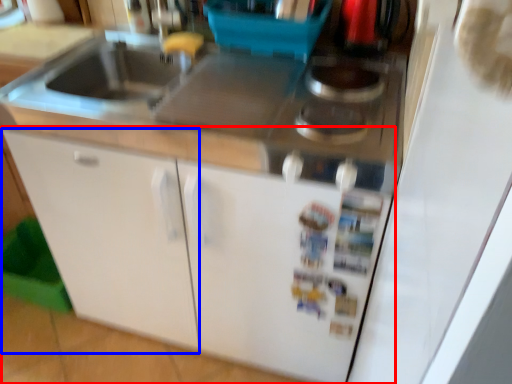
Question: Which point is closer to the camera, cabinetry (highlighted by a red box) or cabinetry (highlighted by a blue box)?

Choices:
 (A) cabinetry
 (B) cabinetry

Answer: (B)